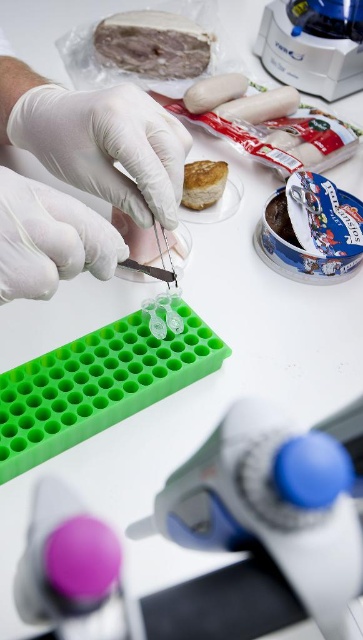
Is point (144, 124) positioned behind point (205, 163)?

No, (144, 124) is in front of (205, 163).

Is white smooth glove at center positioned behind golden brown flaky pastry at upper right?

No, white smooth glove at center is closer to the viewer.

Where is `white smooth glove at center`? white smooth glove at center is located at coordinates (107, 145).

I want to click on white smooth glove at center, so click(107, 145).

Who is shorter, white matte gloves at upper left or white smooth glove at center?

Standing shorter between the two is white smooth glove at center.

In the scene shown: Can you confirm if white matte gloves at upper left is shorter than white smooth glove at center?

Incorrect, white matte gloves at upper left's height does not fall short of white smooth glove at center's.

You are a GUI agent. You are given a task and a screenshot of the screen. Output one action in this format:
    pyautogui.click(x=<x>, y=<y>)
    Task: Click on the white matte gloves at upper left
    
    Given the screenshot: What is the action you would take?
    pyautogui.click(x=98, y=140)

At what (x,y) coordinates should I click in order to perform the action: click on white plastic centrifuge at upper right. Please return your answer as a coordinate pair (x, y). The height and width of the screenshot is (640, 363). Looking at the image, I should click on (311, 49).

Which is behind, point (360, 28) or point (284, 196)?

The point (360, 28) is behind.

Does point (360, 20) come closer to viewer compared to point (282, 228)?

No, it is not.

At what (x,y) coordinates should I click in order to perform the action: click on white plastic centrifuge at upper right. Please return your answer as a coordinate pair (x, y). The width and height of the screenshot is (363, 640). Looking at the image, I should click on (311, 49).